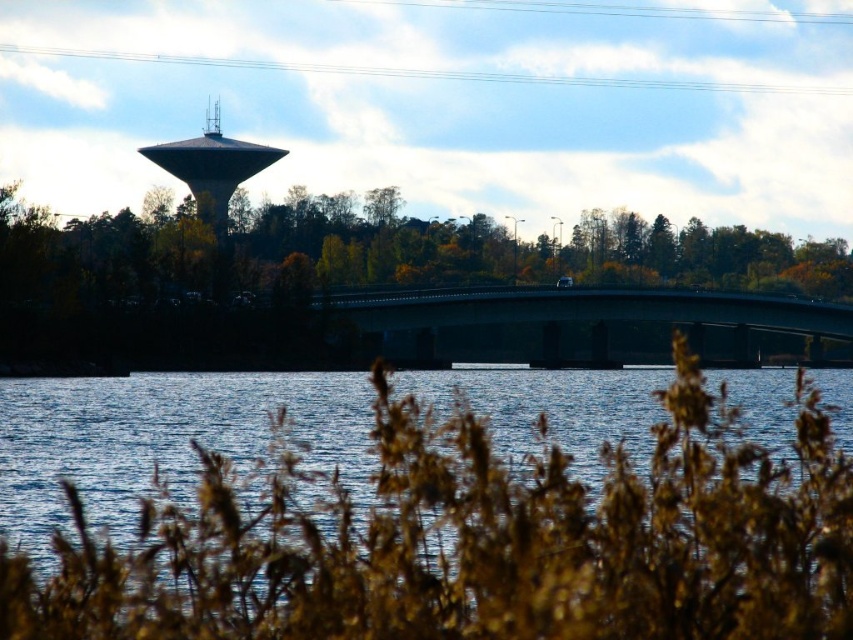
You are a hiker who wants to cross the bridge but needs to know the distance between the green leafy trees at center to ensure your backpack won t get stuck. Can you confirm if the distance is at least 700 feet?

The green leafy trees at center are 608.59 feet apart, which is less than 700 feet. Therefore, the distance might be insufficient for your backpack to pass without getting stuck.

You are a photographer planning to take a wide shot of the green concrete bridge at center and the matte gray water tower at upper center. Given their sizes, which object will occupy more space in your photo?

The green concrete bridge at center is larger in size than the matte gray water tower at upper center, so it will occupy more space in the photo.

You are standing on the concrete bridge spanning the river and want to locate the green leafy trees at center. According to the coordinates provided, in which direction should you look to find them?

The green leafy trees at center are located at coordinates point (529,252). Since the coordinate system is not specified, it is recommended to check the image or consult the coordinate system details for accurate direction.